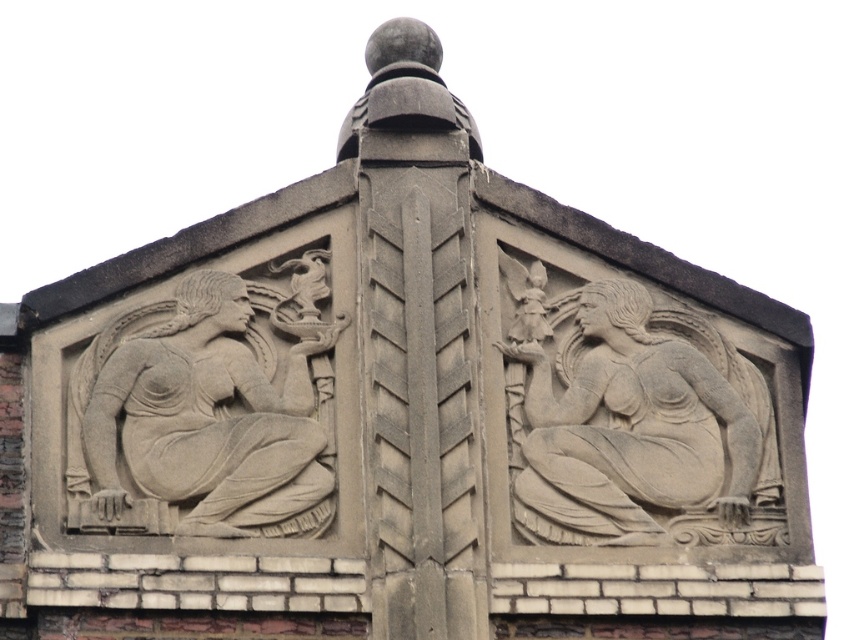
Can you confirm if gray stone angel at upper right is shorter than gray stone sculpture at left?

Indeed, gray stone angel at upper right has a lesser height compared to gray stone sculpture at left.

Between point (530, 522) and point (234, 285), which one is positioned in front?

Point (530, 522) is more forward.

Where is `gray stone angel at upper right`? This screenshot has width=854, height=640. gray stone angel at upper right is located at coordinates (633, 420).